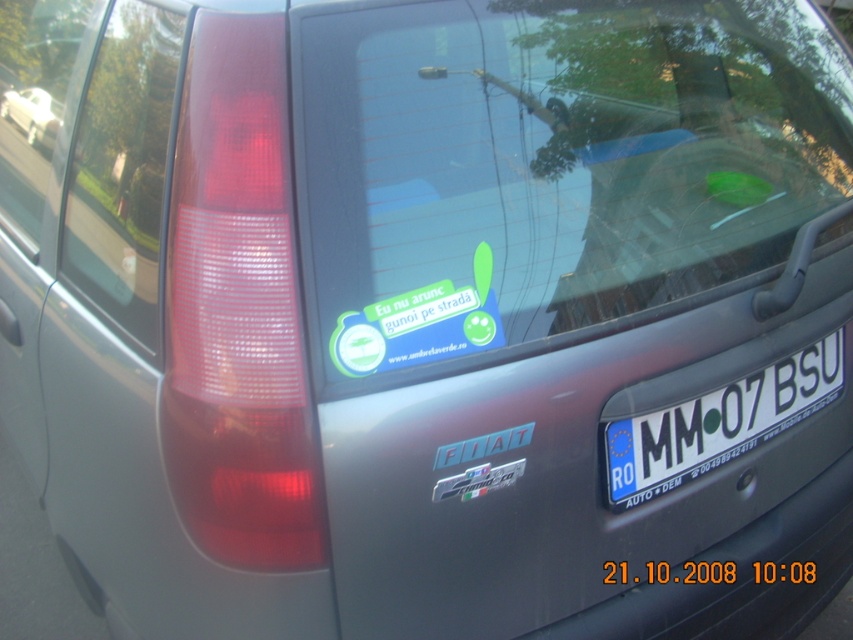
Question: Which object is closer to the camera taking this photo?

Choices:
 (A) white plastic license plate at center
 (B) white glossy sedan at upper left
 (C) transparent glass windshield at upper center
 (D) transparent glass at right

Answer: (C)

Question: Where is transparent glass windshield at upper center located in relation to white glossy sedan at upper left in the image?

Choices:
 (A) below
 (B) above

Answer: (A)

Question: Which object is farther from the camera taking this photo?

Choices:
 (A) white glossy sedan at upper left
 (B) white plastic license plate at center
 (C) transparent glass at right
 (D) transparent glass windshield at upper center

Answer: (A)

Question: Estimate the real-world distances between objects in this image. Which object is closer to the transparent glass windshield at upper center?

Choices:
 (A) white plastic license plate at center
 (B) white glossy sedan at upper left

Answer: (A)

Question: Considering the relative positions of transparent glass windshield at upper center and white glossy sedan at upper left in the image provided, where is transparent glass windshield at upper center located with respect to white glossy sedan at upper left?

Choices:
 (A) left
 (B) right

Answer: (B)

Question: Can you confirm if transparent glass at right is bigger than white plastic license plate at center?

Choices:
 (A) yes
 (B) no

Answer: (A)